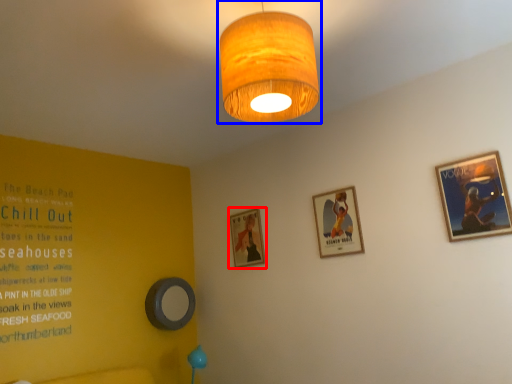
Question: Which object appears closest to the camera in this image, picture frame (highlighted by a red box) or lamp (highlighted by a blue box)?

Choices:
 (A) picture frame
 (B) lamp

Answer: (B)